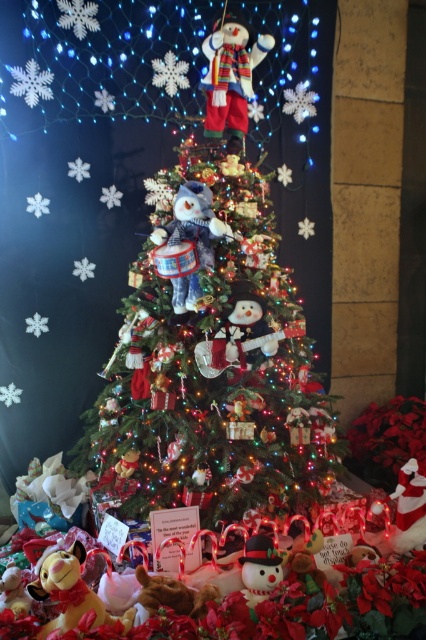
Question: Which point appears farthest from the camera in this image?

Choices:
 (A) (201, 209)
 (B) (154, 266)

Answer: (B)

Question: Can you confirm if knitted wool snowman at upper center is bigger than fluffy blue plush at center?

Choices:
 (A) no
 (B) yes

Answer: (A)

Question: Is fluffy blue plush at center positioned in front of velvet plush cat at lower left?

Choices:
 (A) no
 (B) yes

Answer: (A)

Question: Can you confirm if green matte christmas tree at center is positioned below velvet plush cat at lower left?

Choices:
 (A) yes
 (B) no

Answer: (B)

Question: Which point is closer to the camera taking this photo?

Choices:
 (A) (97, 616)
 (B) (229, 28)

Answer: (A)

Question: Which of these objects is positioned closest to the fluffy blue plush at center?

Choices:
 (A) matte plastic snowman at lower center
 (B) white plush santa at lower right
 (C) knitted wool snowman at upper center
 (D) velvet plush cat at lower left

Answer: (C)